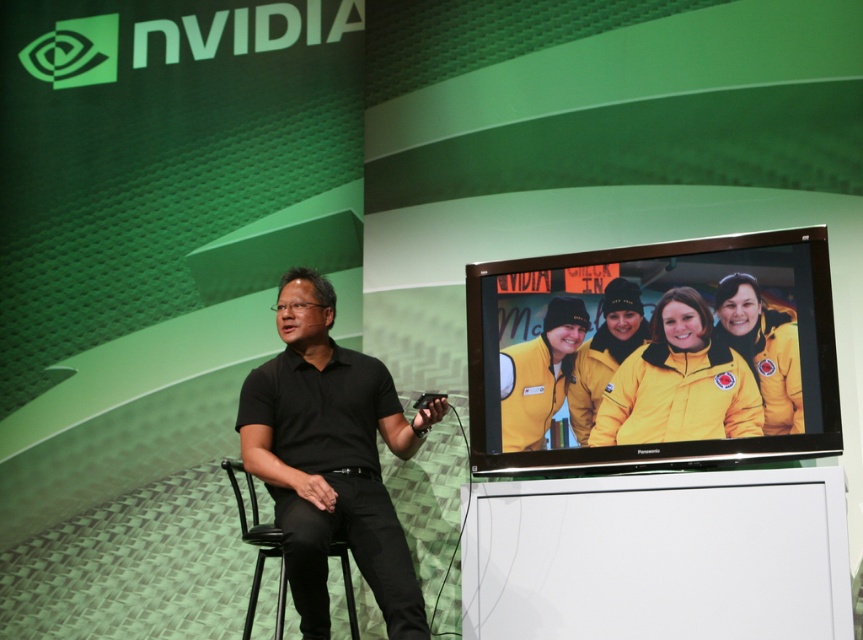
Is point (703, 272) closer to camera compared to point (350, 417)?

Yes, it is.

Is yellow fabric screen at right smaller than black matte shirt at center?

Yes, yellow fabric screen at right is smaller than black matte shirt at center.

Which is behind, point (820, 403) or point (288, 548)?

Point (820, 403)

Identify the location of yellow fabric screen at right. The height and width of the screenshot is (640, 863). (653, 355).

Which is below, yellow fabric screen at right or black plastic chair at center?

black plastic chair at center is below.

This screenshot has width=863, height=640. Describe the element at coordinates (653, 355) in the screenshot. I see `yellow fabric screen at right` at that location.

Where is `yellow fabric screen at right`? Image resolution: width=863 pixels, height=640 pixels. yellow fabric screen at right is located at coordinates (653, 355).

Does point (309, 541) lie behind point (230, 483)?

No, (309, 541) is in front of (230, 483).

In the scene shown: Between black matte shirt at center and black plastic chair at center, which one is positioned higher?

black matte shirt at center is above.

The width and height of the screenshot is (863, 640). I want to click on black matte shirt at center, so click(x=331, y=458).